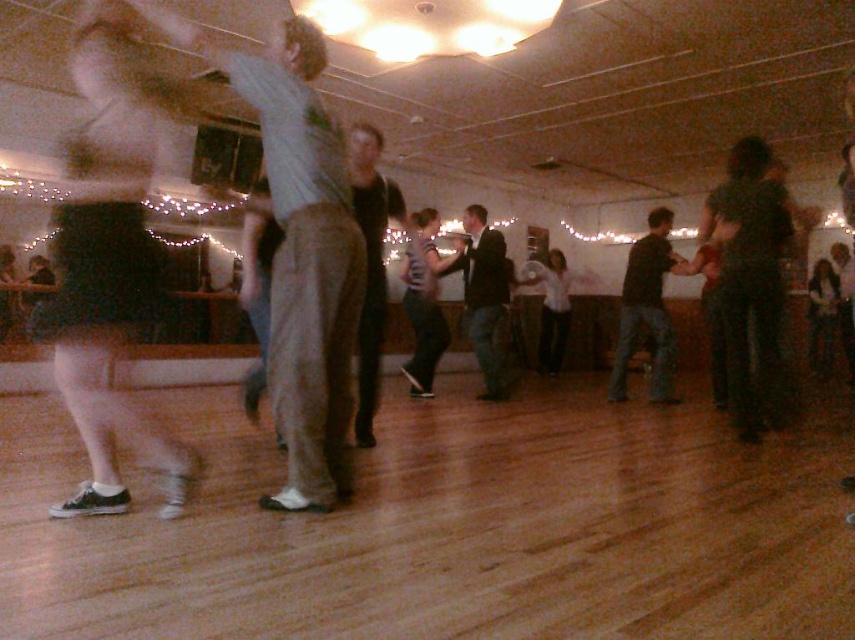
You are a photographer at the dance event and want to capture a clear photo of both the dark gray pants at center and the white matte shirt at center. Since the dancers are moving quickly, you need to adjust your camera settings. Which object should you focus on first to ensure it appears sharp in the photo?

The dark gray pants at center is thinner than white matte shirt at center, so you should focus on the dark gray pants at center first because thinner objects require a narrower depth of field to keep them sharp when moving.

You are a photographer at the dance event and want to capture a photo focusing on the light gray cotton pants at center and smooth black dress at center. Which of these two items is positioned closer to the camera?

The light gray cotton pants at center is closer to the viewer than the smooth black dress at center, so it will appear larger and more prominent in the photo.

You are a photographer at the dance event and want to capture a photo of both the dark blue jeans at center and the smooth black dress at center. Since you want to focus on the clothing items, which one should you adjust your camera to prioritize in terms of framing to ensure both fit in the shot?

The dark blue jeans at center is wider than the smooth black dress at center, so you should frame the shot to accommodate the wider dark blue jeans at center to ensure both fit in the photo.